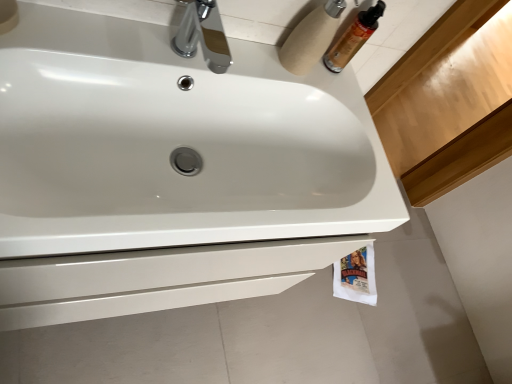
This screenshot has width=512, height=384. In order to click on free spot to the right of white paper towel at lower right, the 1th toilet paper when ordered from right to left in this screenshot , I will do `click(393, 300)`.